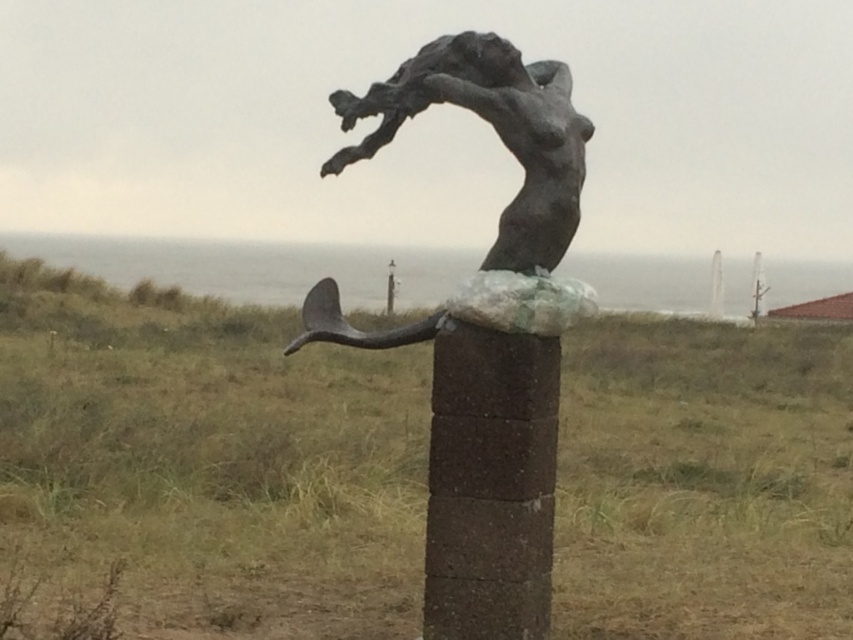
Question: Among these points, which one is nearest to the camera?

Choices:
 (A) (518, 80)
 (B) (514, 369)

Answer: (B)

Question: Can you confirm if brown stone pole at center is thinner than bronze sculpture at center?

Choices:
 (A) yes
 (B) no

Answer: (A)

Question: Which point is closer to the camera?

Choices:
 (A) brown stone pole at center
 (B) bronze sculpture at center
 (C) bronze mermaid at center

Answer: (B)

Question: Which object appears farthest from the camera in this image?

Choices:
 (A) brown stone pole at center
 (B) bronze mermaid at center
 (C) bronze sculpture at center

Answer: (B)

Question: Can you confirm if brown stone pole at center is positioned to the left of bronze mermaid at center?

Choices:
 (A) no
 (B) yes

Answer: (A)

Question: Where is brown stone pole at center located in relation to bronze sculpture at center in the image?

Choices:
 (A) below
 (B) above

Answer: (A)